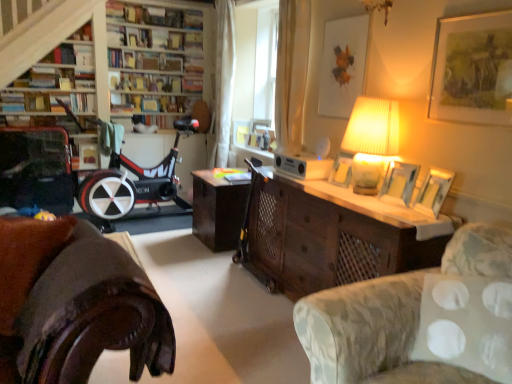
Where is `vacant area that is in front of wooden picture frame at right, which is the 2th picture frame from front to back`? vacant area that is in front of wooden picture frame at right, which is the 2th picture frame from front to back is located at coordinates (426, 221).